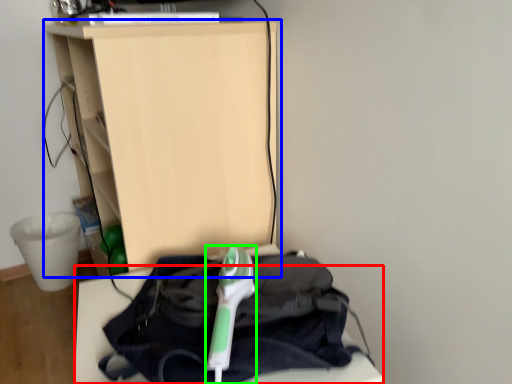
Question: Which object is positioned closest to furniture (highlighted by a red box)? Select from furniture (highlighted by a blue box) and equipment (highlighted by a green box).

Choices:
 (A) furniture
 (B) equipment

Answer: (B)